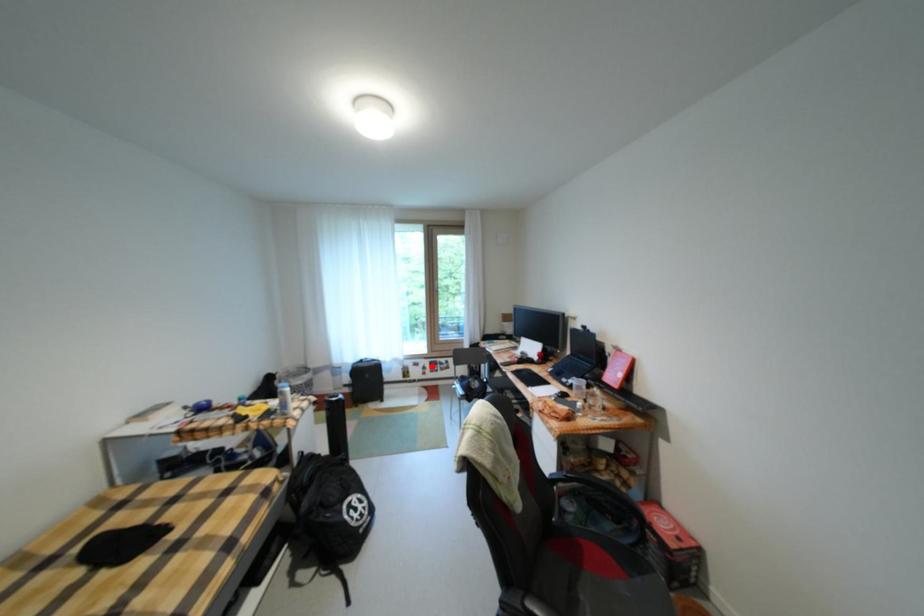
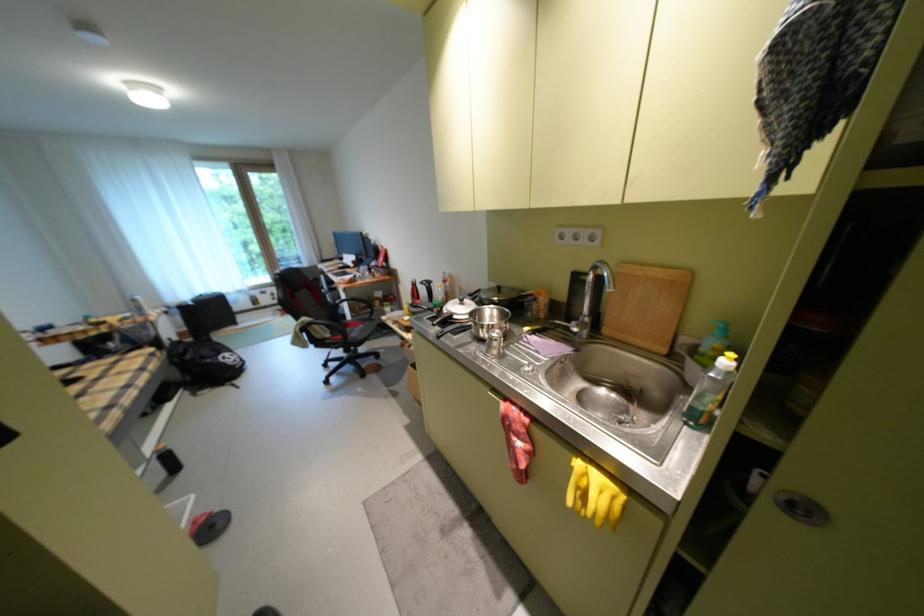
Where in the second image is the point corresponding to the highlighted location from the first image?

(280, 294)